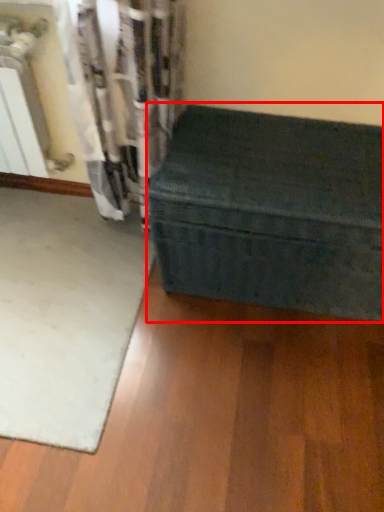
Question: Observing the image, what is the correct spatial positioning of furniture (annotated by the red box) in reference to mat?

Choices:
 (A) right
 (B) left

Answer: (A)